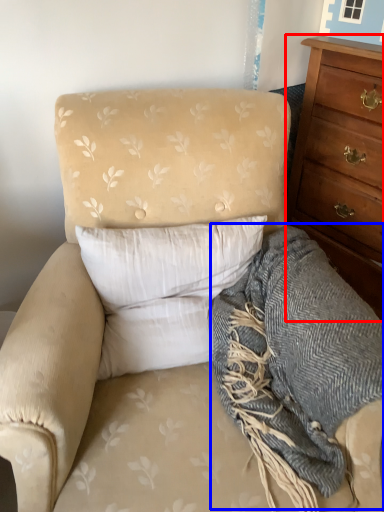
Question: Among these objects, which one is farthest to the camera, chest of drawers (highlighted by a red box) or blanket (highlighted by a blue box)?

Choices:
 (A) chest of drawers
 (B) blanket

Answer: (A)